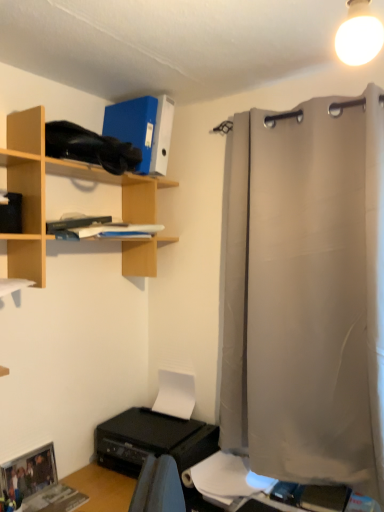
Question: From a real-world perspective, is white matte paper at lower center physically below light gray fabric curtain at right?

Choices:
 (A) no
 (B) yes

Answer: (B)

Question: From a real-world perspective, is white matte paper at lower center located higher than light gray fabric curtain at right?

Choices:
 (A) yes
 (B) no

Answer: (B)

Question: From the image's perspective, is white matte paper at lower center over light gray fabric curtain at right?

Choices:
 (A) yes
 (B) no

Answer: (B)

Question: Can you confirm if white matte paper at lower center is thinner than light gray fabric curtain at right?

Choices:
 (A) no
 (B) yes

Answer: (B)

Question: Is white matte paper at lower center oriented towards light gray fabric curtain at right?

Choices:
 (A) no
 (B) yes

Answer: (A)

Question: From a real-world perspective, relative to white paper at lower center, is white glossy light bulb at upper right vertically above or below?

Choices:
 (A) below
 (B) above

Answer: (B)

Question: Relative to white paper at lower center, is white glossy light bulb at upper right in front or behind?

Choices:
 (A) behind
 (B) front

Answer: (B)

Question: Does point (347, 53) appear closer or farther from the camera than point (246, 489)?

Choices:
 (A) farther
 (B) closer

Answer: (B)

Question: Is white glossy light bulb at upper right taller or shorter than white paper at lower center?

Choices:
 (A) short
 (B) tall

Answer: (B)

Question: From a real-world perspective, is wooden shelf at upper left positioned above or below white matte paper at lower center?

Choices:
 (A) below
 (B) above

Answer: (B)

Question: Relative to white matte paper at lower center, is wooden shelf at upper left in front or behind?

Choices:
 (A) behind
 (B) front

Answer: (B)

Question: Looking at the image, does wooden shelf at upper left seem bigger or smaller compared to white matte paper at lower center?

Choices:
 (A) small
 (B) big

Answer: (B)

Question: From the image's perspective, relative to white matte paper at lower center, is wooden shelf at upper left above or below?

Choices:
 (A) above
 (B) below

Answer: (A)

Question: Is light gray fabric curtain at right wider or thinner than white paper at lower center?

Choices:
 (A) thin
 (B) wide

Answer: (A)

Question: In terms of height, does light gray fabric curtain at right look taller or shorter compared to white paper at lower center?

Choices:
 (A) tall
 (B) short

Answer: (A)